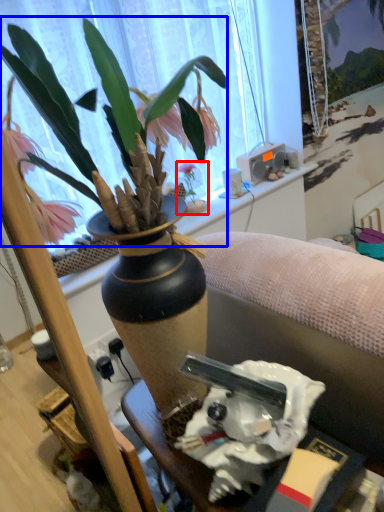
Question: Which object appears farthest to the camera in this image, houseplant (highlighted by a red box) or flower (highlighted by a blue box)?

Choices:
 (A) houseplant
 (B) flower

Answer: (A)